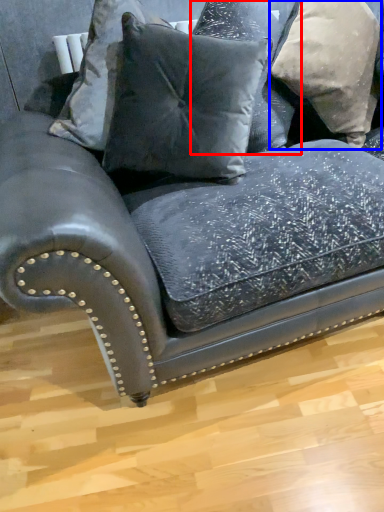
Question: Which point is further to the camera, pillow (highlighted by a red box) or pillow (highlighted by a blue box)?

Choices:
 (A) pillow
 (B) pillow

Answer: (B)